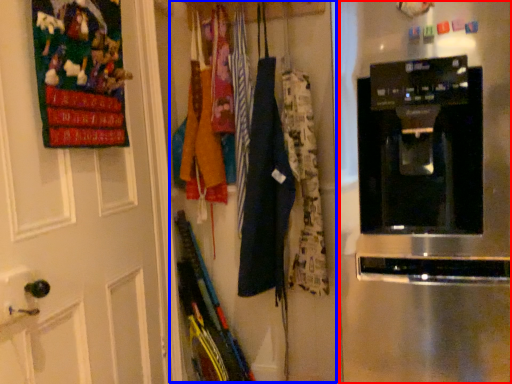
Question: Which object appears closest to the camera in this image, home appliance (highlighted by a red box) or closet (highlighted by a blue box)?

Choices:
 (A) home appliance
 (B) closet

Answer: (A)